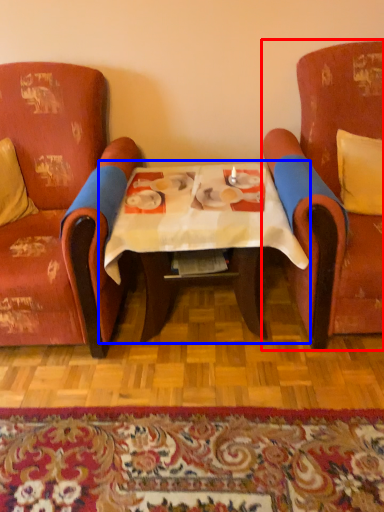
Question: Among these objects, which one is nearest to the camera, chair (highlighted by a red box) or table (highlighted by a blue box)?

Choices:
 (A) chair
 (B) table

Answer: (A)